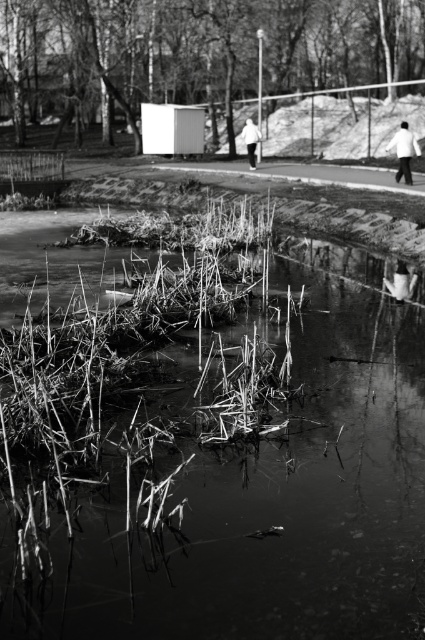
Question: Estimate the real-world distances between objects in this image. Which object is closer to the reeds at lower center?

Choices:
 (A) white matte jacket at center
 (B) white matte jacket at upper right

Answer: (B)

Question: Which object is positioned farthest from the white matte jacket at upper right?

Choices:
 (A) white fabric shoe at lower right
 (B) white matte jacket at center
 (C) reeds at lower center

Answer: (C)

Question: Does reeds at lower center appear on the right side of white matte jacket at center?

Choices:
 (A) no
 (B) yes

Answer: (A)

Question: Observing the image, what is the correct spatial positioning of white matte jacket at upper right in reference to white matte jacket at center?

Choices:
 (A) right
 (B) left

Answer: (A)

Question: Which of the following is the farthest from the observer?

Choices:
 (A) (246, 122)
 (B) (407, 138)
 (C) (413, 275)
 (D) (365, 612)

Answer: (A)

Question: Can you confirm if reeds at lower center is positioned below white fabric shoe at lower right?

Choices:
 (A) no
 (B) yes

Answer: (B)